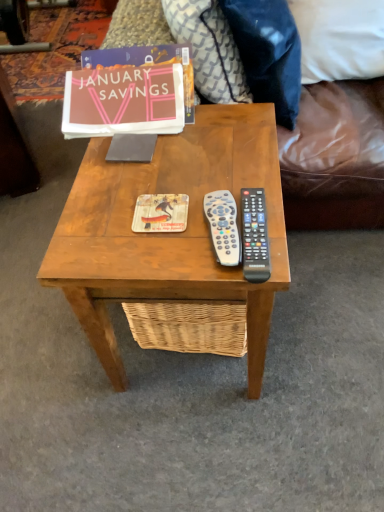
Locate an element on the screen. This screenshot has width=384, height=512. free space on the front side of matte paper book cover at center is located at coordinates (165, 254).